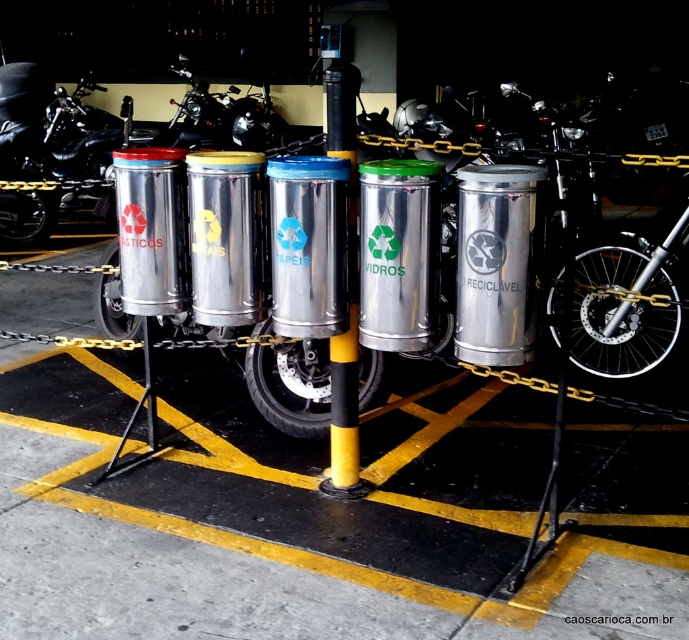
You are a delivery person who needs to park your shiny black motorcycle at center near the recycling station. There is a yellow matte pole at center in the way. Can you move the motorcycle around the pole without needing to adjust its position much?

The shiny black motorcycle at center is larger than the yellow matte pole at center, so you can move the motorcycle around the pole without needing to adjust its position much since the motorcycle is bigger and can easily navigate around the smaller pole.

You are a delivery person who needs to park your shiny black motorcycle at center near the recycling station. There is a yellow matte pole at center blocking the path. Can you safely pass under the pole with your motorcycle without hitting it?

The shiny black motorcycle at center is taller than the yellow matte pole at center, so it will hit the pole if you try to pass under it. You need to lower your motorcycle or find another path.

You are a delivery person who needs to park your motorcycle between two other motorcycles at a recycling station. The shiny black motorcycle at center and the brushed metal motorcycle at center are already parked. Can you park your motorcycle, which is 1.5 meters long, between them?

The distance between the shiny black motorcycle at center and the brushed metal motorcycle at center is 1.07 meters, which is shorter than the length of your motorcycle. Therefore, you cannot park your motorcycle between them.